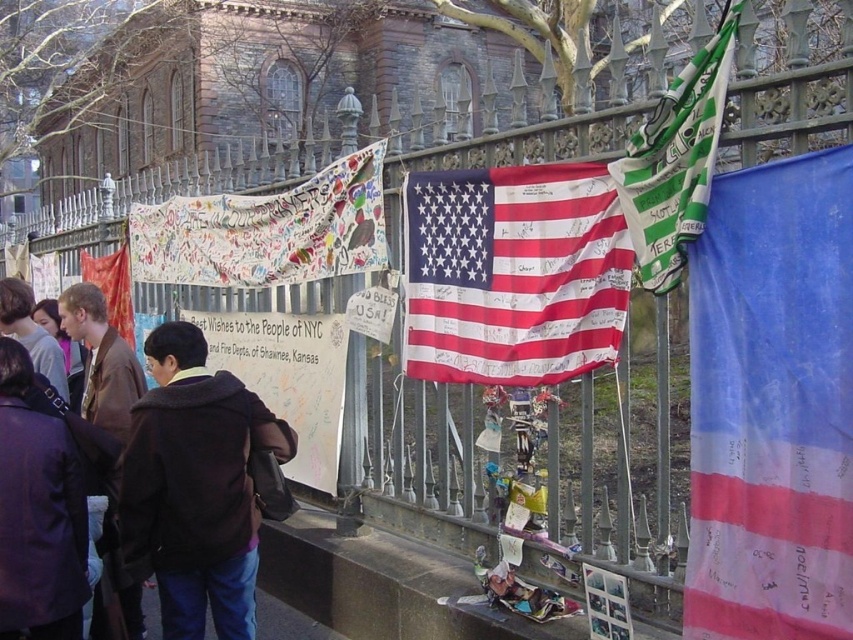
Question: Does matte purple jacket at lower left have a lesser width compared to metallic silver photo album at center?

Choices:
 (A) no
 (B) yes

Answer: (A)

Question: Which object is farther from the camera taking this photo?

Choices:
 (A) metallic silver photo album at center
 (B) green fabric flag at upper right
 (C) white paper at center

Answer: (C)

Question: Estimate the real-world distances between objects in this image. Which object is farther from the white painted fabric at center?

Choices:
 (A) white paper at center
 (B) matte purple jacket at lower left

Answer: (B)

Question: Among these points, which one is farthest from the camera?

Choices:
 (A) (598, 625)
 (B) (35, 358)
 (C) (170, 356)
 (D) (577, 337)

Answer: (B)

Question: Can you confirm if dark brown jacket at center is positioned to the left of brown leather jacket at center?

Choices:
 (A) yes
 (B) no

Answer: (B)

Question: Does white paper at center have a larger size compared to metallic silver photo album at center?

Choices:
 (A) no
 (B) yes

Answer: (B)